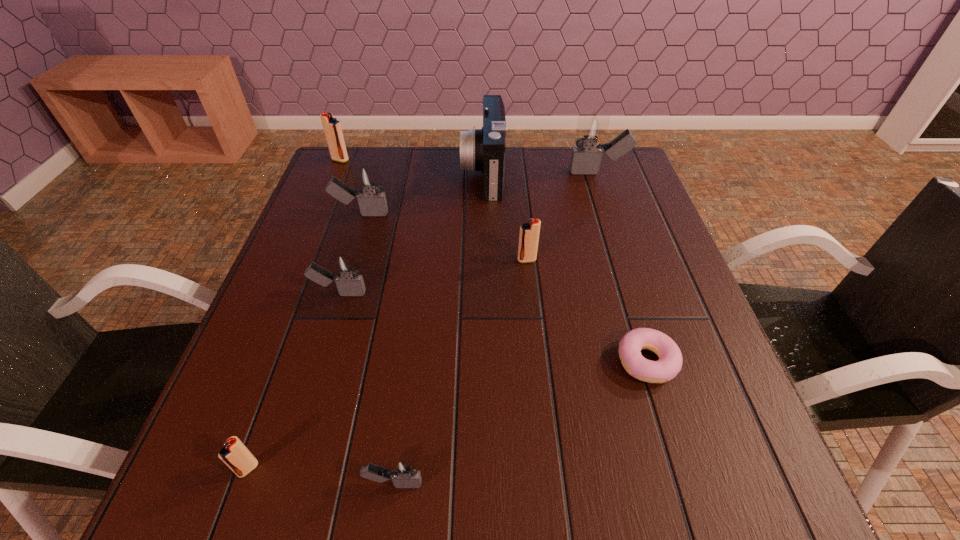
Locate an element on the screen. unoccupied position between the smallest red igniter and the rightmost red igniter is located at coordinates (388, 364).

Where is `object that is the sixth closest one to the fifth object from left to right`? object that is the sixth closest one to the fifth object from left to right is located at coordinates (483, 149).

Point out which object is positioned as the eighth nearest to the fifth farthest igniter. Please provide its 2D coordinates. Your answer should be formatted as a tuple, i.e. [(x, y)], where the tuple contains the x and y coordinates of a point satisfying the conditions above.

[(591, 130)]

Identify which igniter is located as the second nearest to the second farthest igniter. Please provide its 2D coordinates. Your answer should be formatted as a tuple, i.e. [(x, y)], where the tuple contains the x and y coordinates of a point satisfying the conditions above.

[(372, 202)]

This screenshot has height=540, width=960. In order to click on igniter that can be found as the fifth closest to the smallest red igniter in this screenshot , I will do `click(332, 128)`.

Identify which gray igniter is the second closest to the second nearest red igniter. Please provide its 2D coordinates. Your answer should be formatted as a tuple, i.e. [(x, y)], where the tuple contains the x and y coordinates of a point satisfying the conditions above.

[(345, 272)]

Image resolution: width=960 pixels, height=540 pixels. Find the location of `gray igniter that is the third closest to the seventh farthest object`. gray igniter that is the third closest to the seventh farthest object is located at coordinates (591, 130).

Locate which red igniter ranks in proximity to the seventh farthest object. Please provide its 2D coordinates. Your answer should be formatted as a tuple, i.e. [(x, y)], where the tuple contains the x and y coordinates of a point satisfying the conditions above.

[(529, 232)]

Select which red igniter appears as the closest to the farthest igniter. Please provide its 2D coordinates. Your answer should be formatted as a tuple, i.e. [(x, y)], where the tuple contains the x and y coordinates of a point satisfying the conditions above.

[(529, 232)]

This screenshot has height=540, width=960. Find the location of `vacant space that satisfies the following two spatial constraints: 1. on the front side of the third gray igniter from left to right; 2. on the right side of the second red igniter from left to right`. vacant space that satisfies the following two spatial constraints: 1. on the front side of the third gray igniter from left to right; 2. on the right side of the second red igniter from left to right is located at coordinates [243, 483].